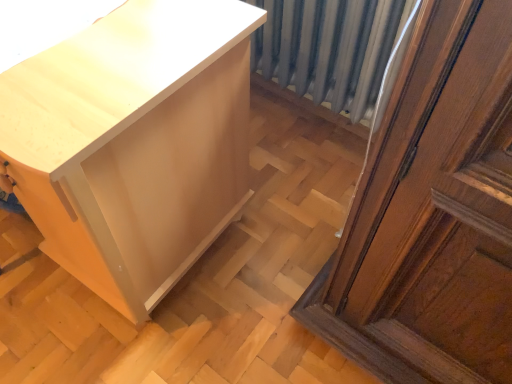
Question: Should I look upward or downward to see white glossy cabinet at lower left?

Choices:
 (A) down
 (B) up

Answer: (B)

Question: Is metallic gray radiator at center thinner than white glossy cabinet at lower left?

Choices:
 (A) no
 (B) yes

Answer: (B)

Question: Is metallic gray radiator at center turned away from white glossy cabinet at lower left?

Choices:
 (A) no
 (B) yes

Answer: (A)

Question: Can you confirm if metallic gray radiator at center is taller than white glossy cabinet at lower left?

Choices:
 (A) no
 (B) yes

Answer: (A)

Question: From the image's perspective, is metallic gray radiator at center located beneath white glossy cabinet at lower left?

Choices:
 (A) yes
 (B) no

Answer: (B)

Question: Can you confirm if metallic gray radiator at center is positioned to the right of white glossy cabinet at lower left?

Choices:
 (A) no
 (B) yes

Answer: (B)

Question: From a real-world perspective, is metallic gray radiator at center on top of white glossy cabinet at lower left?

Choices:
 (A) yes
 (B) no

Answer: (A)

Question: Considering the relative positions of white glossy cabinet at lower left and metallic gray radiator at center in the image provided, is white glossy cabinet at lower left to the left of metallic gray radiator at center from the viewer's perspective?

Choices:
 (A) yes
 (B) no

Answer: (A)

Question: Is metallic gray radiator at center a part of white glossy cabinet at lower left?

Choices:
 (A) no
 (B) yes

Answer: (A)

Question: Considering the relative sizes of white glossy cabinet at lower left and metallic gray radiator at center in the image provided, is white glossy cabinet at lower left thinner than metallic gray radiator at center?

Choices:
 (A) yes
 (B) no

Answer: (B)

Question: Is white glossy cabinet at lower left further to the viewer compared to metallic gray radiator at center?

Choices:
 (A) no
 (B) yes

Answer: (A)

Question: Is white glossy cabinet at lower left turned away from metallic gray radiator at center?

Choices:
 (A) no
 (B) yes

Answer: (B)

Question: Is white glossy cabinet at lower left to the right of metallic gray radiator at center from the viewer's perspective?

Choices:
 (A) no
 (B) yes

Answer: (A)

Question: Relative to metallic gray radiator at center, is white glossy cabinet at lower left in front or behind?

Choices:
 (A) behind
 (B) front

Answer: (B)